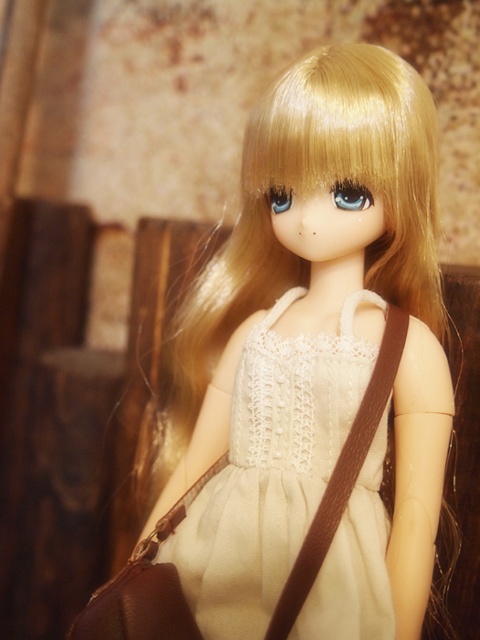
You are standing in front of the doll and want to place a small sticker exactly at the point labeled point [303,422]. If the sticker is 2 inches in diameter, will it fit without overlapping any part of the doll?

The point labeled point [303,422] is 35.51 inches from the viewer. Since the sticker is only 2 inches in diameter, it will fit without overlapping any part of the doll as there is sufficient space around the point.

The doll is wearing a white lace dress at center and carrying a brown leather bag at center. Which item is taller?

The white lace dress at center is much taller than the brown leather bag at center.